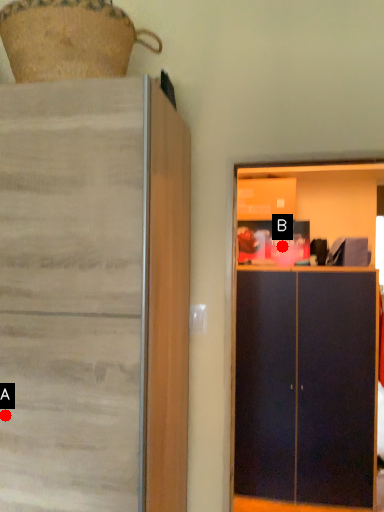
Question: Two points are circled on the image, labeled by A and B beside each circle. Which point appears closest to the camera in this image?

Choices:
 (A) A is closer
 (B) B is closer

Answer: (A)